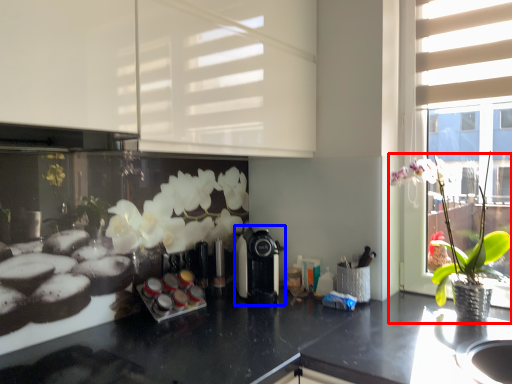
Question: Which of the following is the closest to the observer, houseplant (highlighted by a red box) or coffee machine (highlighted by a blue box)?

Choices:
 (A) houseplant
 (B) coffee machine

Answer: (A)